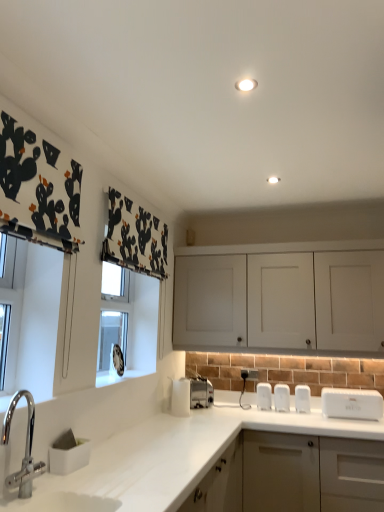
Question: From the image's perspective, is matte white cabinet at lower right, arranged as the 2th cabinetry when viewed from the top, over white plastic salt and pepper shakers at center, which is the second appliance from left to right?

Choices:
 (A) no
 (B) yes

Answer: (A)

Question: Does matte white cabinet at lower right, placed as the first cabinetry when sorted from bottom to top, appear on the left side of white plastic salt and pepper shakers at center, which is the second appliance from left to right?

Choices:
 (A) no
 (B) yes

Answer: (A)

Question: From the image's perspective, is matte white cabinet at lower right, arranged as the 2th cabinetry when viewed from the top, below white plastic salt and pepper shakers at center, placed as the 2th appliance when sorted from right to left?

Choices:
 (A) yes
 (B) no

Answer: (A)

Question: Is matte white cabinet at lower right, arranged as the 2th cabinetry when viewed from the top, oriented towards white plastic salt and pepper shakers at center, placed as the 2th appliance when sorted from right to left?

Choices:
 (A) no
 (B) yes

Answer: (A)

Question: Considering the relative positions of matte white cabinet at lower right, placed as the first cabinetry when sorted from bottom to top, and white plastic salt and pepper shakers at center, placed as the 2th appliance when sorted from right to left, in the image provided, is matte white cabinet at lower right, placed as the first cabinetry when sorted from bottom to top, to the right of white plastic salt and pepper shakers at center, placed as the 2th appliance when sorted from right to left, from the viewer's perspective?

Choices:
 (A) yes
 (B) no

Answer: (A)

Question: Considering the positions of white matte cabinet at upper center, which ranks as the 1th cabinetry in top-to-bottom order, and white plastic electric outlet at lower center in the image, is white matte cabinet at upper center, which ranks as the 1th cabinetry in top-to-bottom order, taller or shorter than white plastic electric outlet at lower center?

Choices:
 (A) tall
 (B) short

Answer: (A)

Question: Which is correct: white matte cabinet at upper center, the 2th cabinetry from the bottom, is inside white plastic electric outlet at lower center, or outside of it?

Choices:
 (A) outside
 (B) inside

Answer: (A)

Question: Considering their positions, is white matte cabinet at upper center, which ranks as the 1th cabinetry in top-to-bottom order, located in front of or behind white plastic electric outlet at lower center?

Choices:
 (A) behind
 (B) front

Answer: (B)

Question: From a real-world perspective, is white matte cabinet at upper center, the 2th cabinetry from the bottom, above or below white plastic electric outlet at lower center?

Choices:
 (A) above
 (B) below

Answer: (A)

Question: Is white plastic electric outlet at lower center taller or shorter than satin silver toaster at lower center, placed as the first appliance when sorted from left to right?

Choices:
 (A) short
 (B) tall

Answer: (A)

Question: Relative to satin silver toaster at lower center, placed as the first appliance when sorted from left to right, is white plastic electric outlet at lower center in front or behind?

Choices:
 (A) behind
 (B) front

Answer: (A)

Question: Considering the positions of point (246, 374) and point (193, 404), is point (246, 374) closer or farther from the camera than point (193, 404)?

Choices:
 (A) farther
 (B) closer

Answer: (A)

Question: Would you say white plastic electric outlet at lower center is to the left or to the right of satin silver toaster at lower center, placed as the first appliance when sorted from left to right, in the picture?

Choices:
 (A) left
 (B) right

Answer: (B)

Question: From a real-world perspective, is brushed metal faucet at lower left positioned above or below white plastic salt and pepper shakers at center, which is the second appliance from left to right?

Choices:
 (A) below
 (B) above

Answer: (B)

Question: In terms of width, does brushed metal faucet at lower left look wider or thinner when compared to white plastic salt and pepper shakers at center, which is the second appliance from left to right?

Choices:
 (A) wide
 (B) thin

Answer: (B)